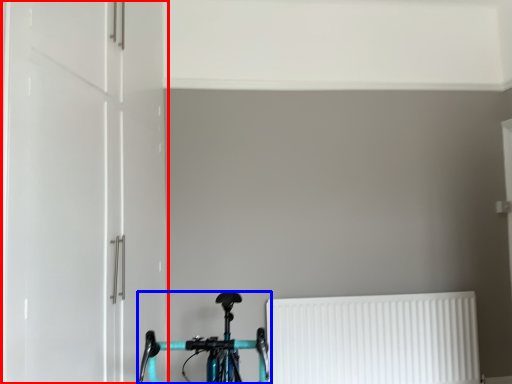
Question: Among these objects, which one is farthest to the camera, door (highlighted by a red box) or bicycle (highlighted by a blue box)?

Choices:
 (A) door
 (B) bicycle

Answer: (A)